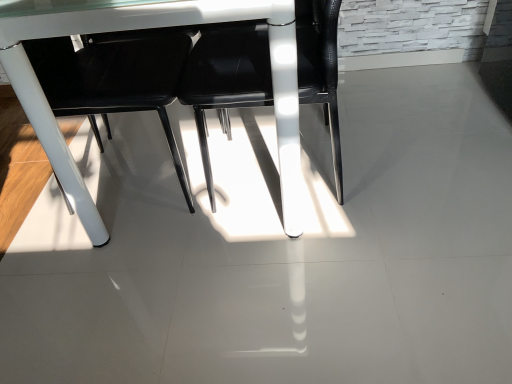
Question: In the image, is white glossy table at center positioned in front of or behind black leather chair at center, which is the first chair from right to left?

Choices:
 (A) front
 (B) behind

Answer: (A)

Question: From a real-world perspective, relative to black leather chair at center, which appears as the 2th chair when viewed from the left, is white glossy table at center vertically above or below?

Choices:
 (A) above
 (B) below

Answer: (A)

Question: Which of these objects is positioned farthest from the black leather chair at center, the 2th chair positioned from the right?

Choices:
 (A) white glossy table at center
 (B) black leather chair at center, which is the first chair from right to left

Answer: (A)

Question: Considering the real-world distances, which object is closest to the white glossy table at center?

Choices:
 (A) black leather chair at center, which is the first chair from right to left
 (B) black leather chair at center, which is the 1th chair from left to right

Answer: (A)